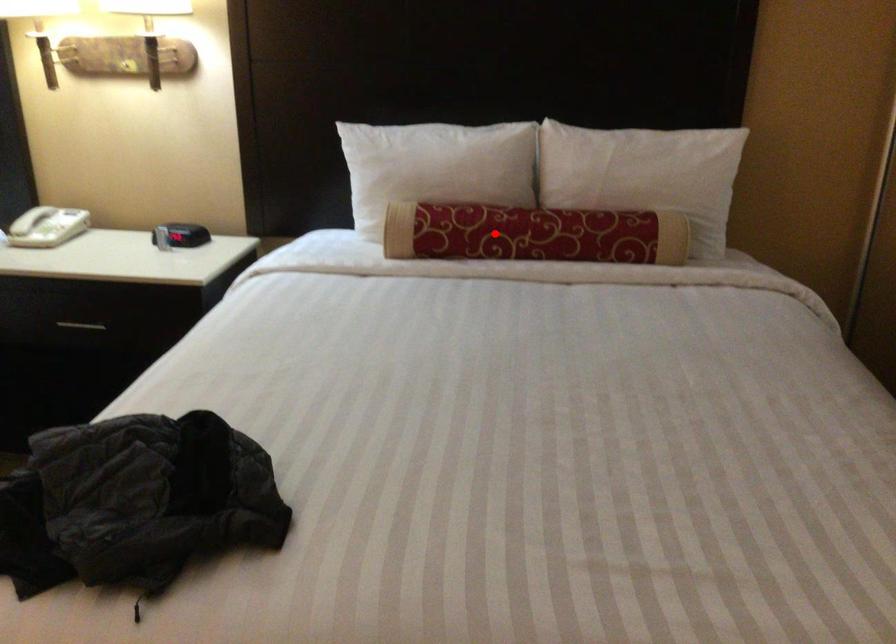
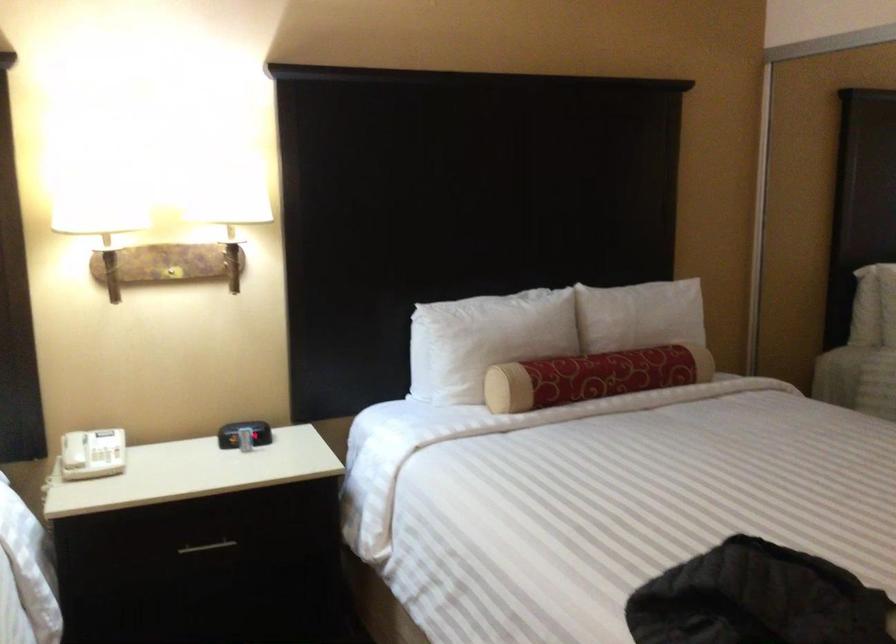
The point at the highlighted location is marked in the first image. Where is the corresponding point in the second image?

(592, 377)